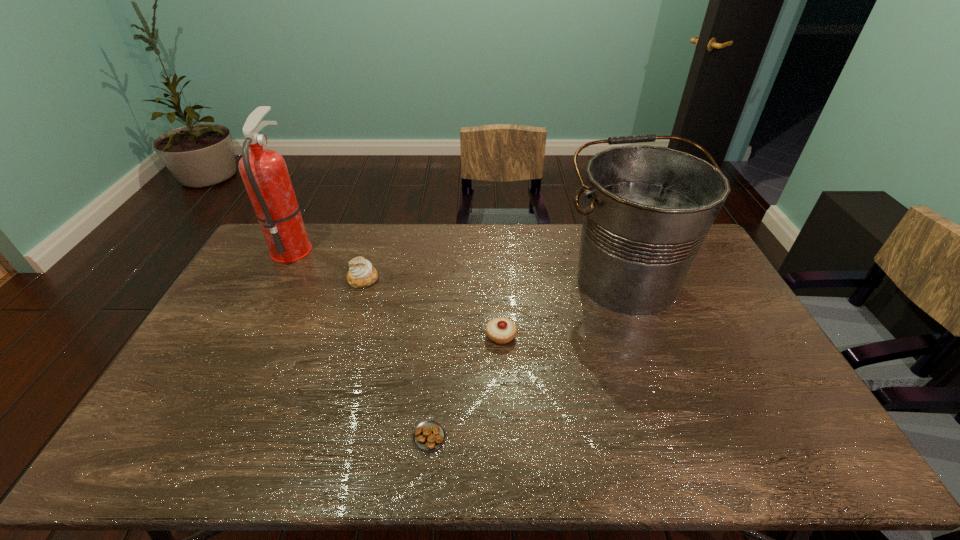
Locate an element on the screen. Image resolution: width=960 pixels, height=540 pixels. the leftmost object is located at coordinates (264, 172).

This screenshot has width=960, height=540. I want to click on the rightmost object, so click(647, 210).

The image size is (960, 540). Find the location of `the second object from left to right`. the second object from left to right is located at coordinates (361, 273).

Locate an element on the screen. Image resolution: width=960 pixels, height=540 pixels. the leftmost pastry is located at coordinates (361, 273).

Find the location of a particular element. the rightmost pastry is located at coordinates (500, 330).

In order to click on the second shortest object in this screenshot , I will do `click(500, 330)`.

The width and height of the screenshot is (960, 540). Identify the location of the nearest object. (429, 435).

The height and width of the screenshot is (540, 960). Identify the location of the nearest pastry. (429, 435).

Find the location of a particular element. Image resolution: width=960 pixels, height=540 pixels. vacant region located with the handle and hose on the fire extinguisher is located at coordinates (342, 247).

Locate an element on the screen. This screenshot has height=540, width=960. blank space located 0.230m on the front of the rightmost object is located at coordinates (664, 384).